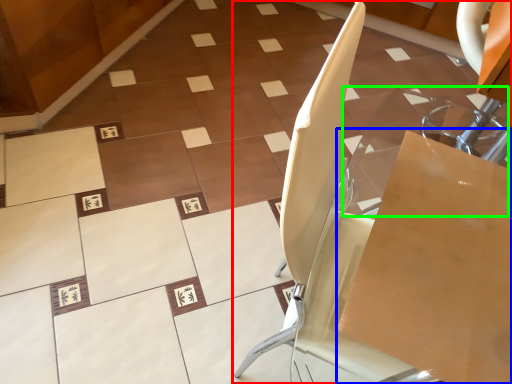
Question: Which object is the farthest from furniture (highlighted by a red box)? Choose among these: cardboard box (highlighted by a blue box) or glass table (highlighted by a green box).

Choices:
 (A) cardboard box
 (B) glass table

Answer: (B)